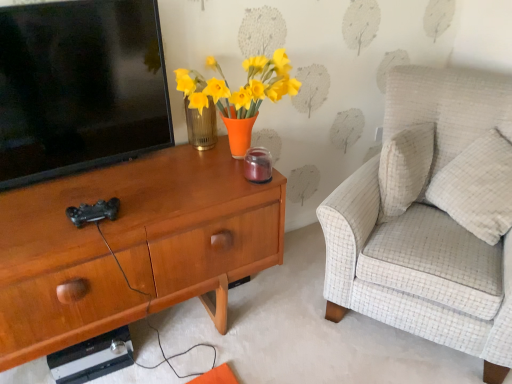
Where is `vacant space to the right of woodendesk at left`? The image size is (512, 384). vacant space to the right of woodendesk at left is located at coordinates (293, 333).